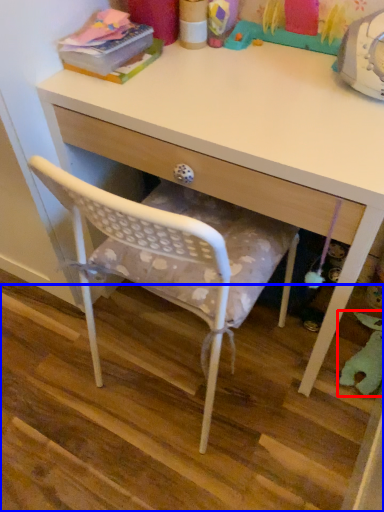
Question: Which point is closer to the camera, toy (highlighted by a red box) or stair (highlighted by a blue box)?

Choices:
 (A) toy
 (B) stair

Answer: (B)